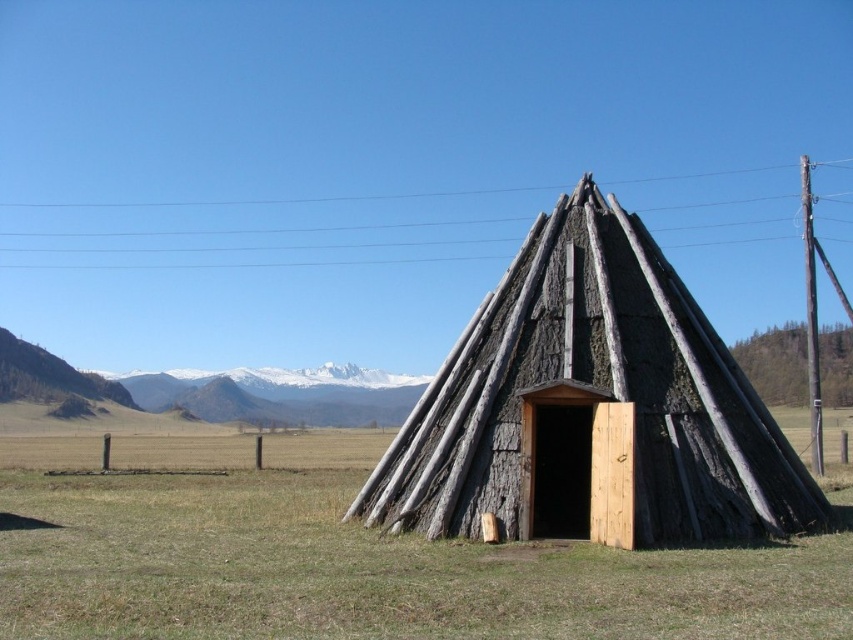
Question: Can you confirm if charred wood hut at center is positioned to the left of white snow-covered mountain at upper center?

Choices:
 (A) no
 (B) yes

Answer: (A)

Question: Which point is closer to the camera?

Choices:
 (A) (570, 276)
 (B) (258, 522)

Answer: (B)

Question: Can you confirm if green grass at center is positioned to the left of charred wood hut at center?

Choices:
 (A) yes
 (B) no

Answer: (B)

Question: Is green grass at center bigger than charred wood hut at center?

Choices:
 (A) no
 (B) yes

Answer: (B)

Question: Which object is the farthest from the green grass at center?

Choices:
 (A) charred wood hut at center
 (B) white snow-covered mountain at upper center

Answer: (B)

Question: Estimate the real-world distances between objects in this image. Which object is closer to the charred wood hut at center?

Choices:
 (A) white snow-covered mountain at upper center
 (B) green grass at center

Answer: (B)